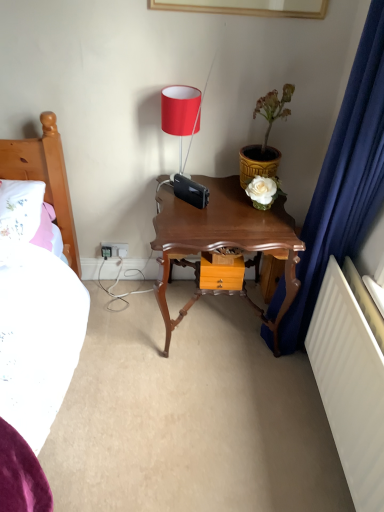
Question: Considering the positions of point (172, 87) and point (246, 150), is point (172, 87) closer or farther from the camera than point (246, 150)?

Choices:
 (A) closer
 (B) farther

Answer: (A)

Question: Is matte red lampshade at upper center wider or thinner than yellow textured pot at upper right?

Choices:
 (A) thin
 (B) wide

Answer: (A)

Question: Estimate the real-world distances between objects in this image. Which object is farther from the shiny brown wooden nightstand at center?

Choices:
 (A) wooden drawer at center
 (B) matte red lampshade at upper center
 (C) yellow textured pot at upper right
 (D) white plastic electrical outlet at lower left

Answer: (D)

Question: Estimate the real-world distances between objects in this image. Which object is closer to the matte red lampshade at upper center?

Choices:
 (A) white plastic electrical outlet at lower left
 (B) wooden drawer at center
 (C) yellow textured pot at upper right
 (D) shiny brown wooden nightstand at center

Answer: (C)